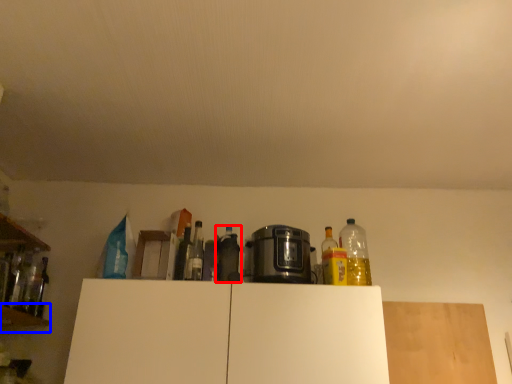
Question: Among these objects, which one is nearest to the camera, bottle (highlighted by a red box) or shelf (highlighted by a blue box)?

Choices:
 (A) bottle
 (B) shelf

Answer: (B)